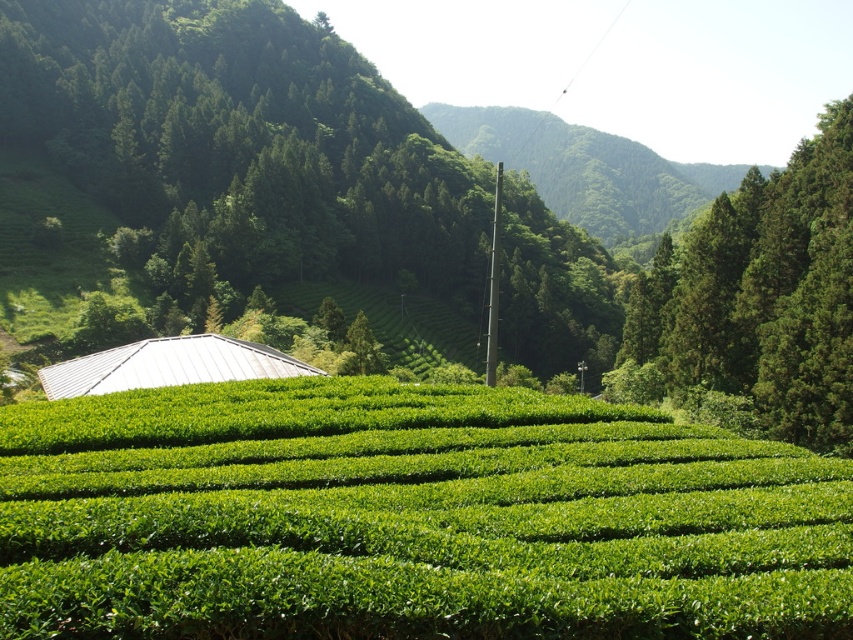
Question: Estimate the real-world distances between objects in this image. Which object is closer to the green leafy hedge at center?

Choices:
 (A) green leafy tree at center
 (B) green leafy tree at upper right

Answer: (B)

Question: Which of these objects is positioned closest to the green leafy hedge at center?

Choices:
 (A) green leafy tree at upper right
 (B) green leafy tree at center

Answer: (A)

Question: Does green leafy tree at center appear under green leafy tree at upper right?

Choices:
 (A) yes
 (B) no

Answer: (B)

Question: Considering the real-world distances, which object is farthest from the green leafy tree at upper right?

Choices:
 (A) green leafy hedge at center
 (B) green leafy tree at center

Answer: (B)

Question: Does green leafy tree at center have a larger size compared to green leafy tree at upper right?

Choices:
 (A) no
 (B) yes

Answer: (B)

Question: In this image, where is green leafy tree at center located relative to green leafy tree at upper right?

Choices:
 (A) above
 (B) below

Answer: (A)